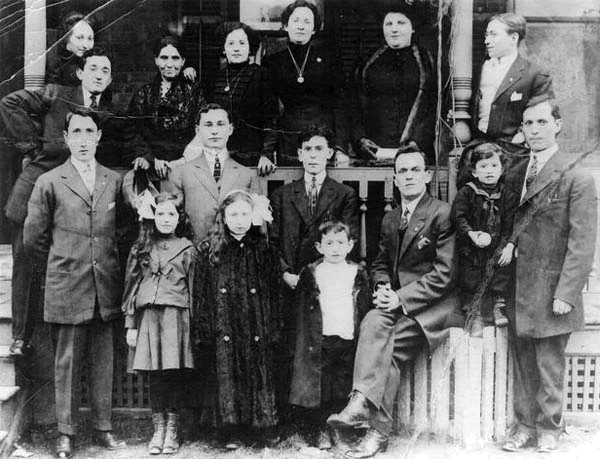
At what (x,y) coordinates should I click in order to perform the action: click on bannister. Please return your answer as a coordinate pair (x, y). This screenshot has width=600, height=459. Looking at the image, I should click on (369, 176).